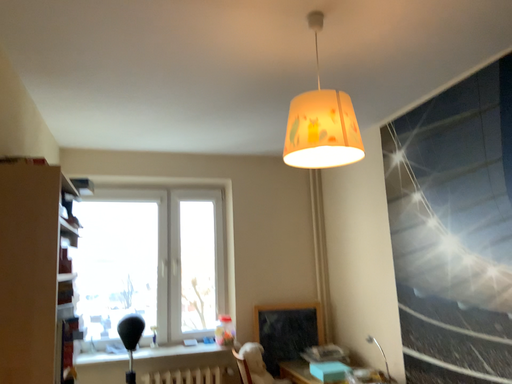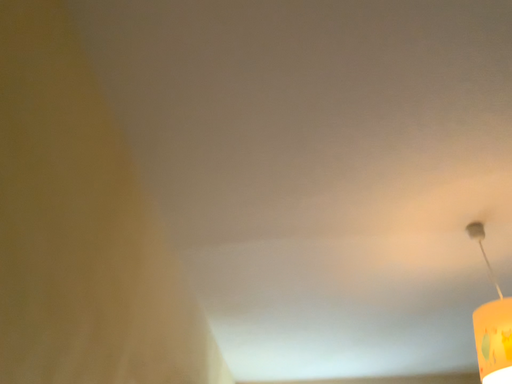
Question: Which way did the camera rotate in the video?

Choices:
 (A) rotated left
 (B) rotated right

Answer: (A)